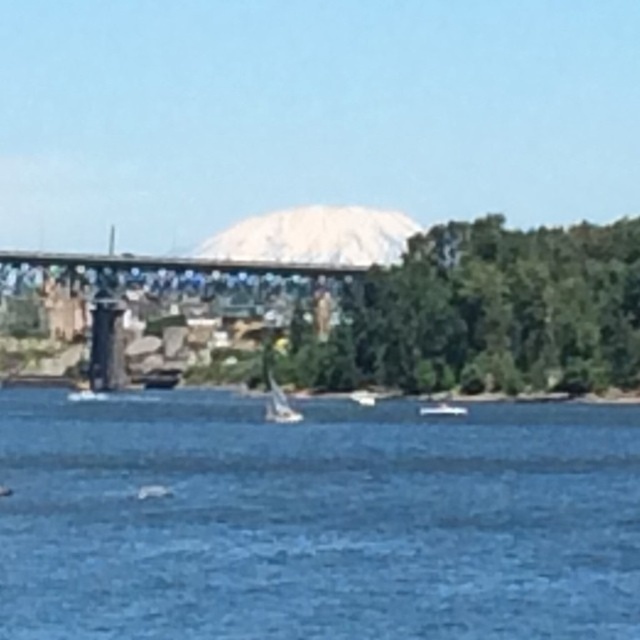
Question: Among these objects, which one is nearest to the camera?

Choices:
 (A) blue water at center
 (B) white glossy boat at center
 (C) white glossy sailboat at center
 (D) white matte sailboat at center

Answer: (A)

Question: Can you confirm if white matte sailboat at center is wider than white glossy boat at center?

Choices:
 (A) yes
 (B) no

Answer: (B)

Question: Does white glossy boat at center appear under white glossy sailboat at center?

Choices:
 (A) yes
 (B) no

Answer: (A)

Question: Does metal bridge at center appear on the left side of white glossy sailboat at center?

Choices:
 (A) yes
 (B) no

Answer: (A)

Question: Which is farther from the metal bridge at center?

Choices:
 (A) white glossy sailboat at center
 (B) white matte sailboat at center
 (C) white glossy boat at center
 (D) blue water at center

Answer: (D)

Question: Which point is closer to the camera taking this photo?

Choices:
 (A) (364, 392)
 (B) (45, 262)

Answer: (A)